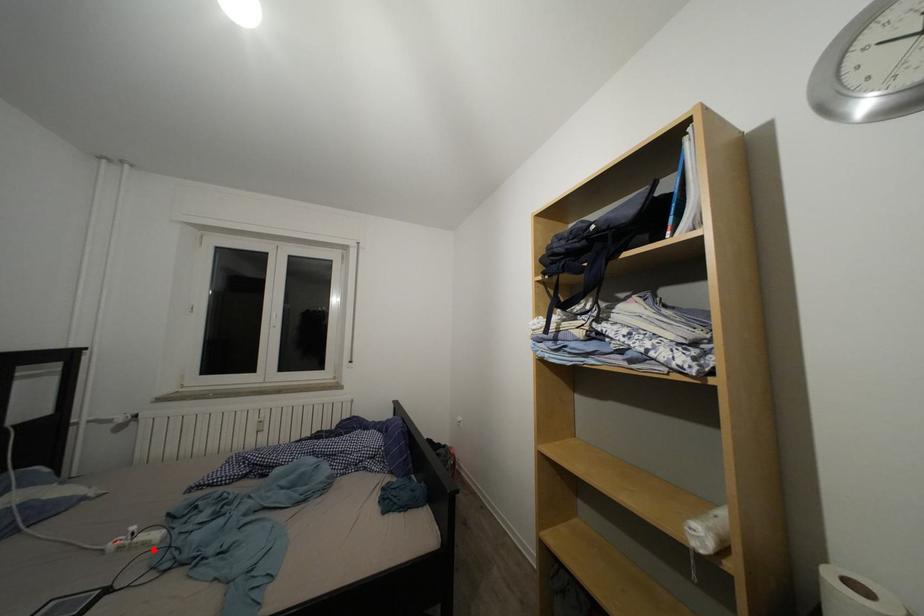
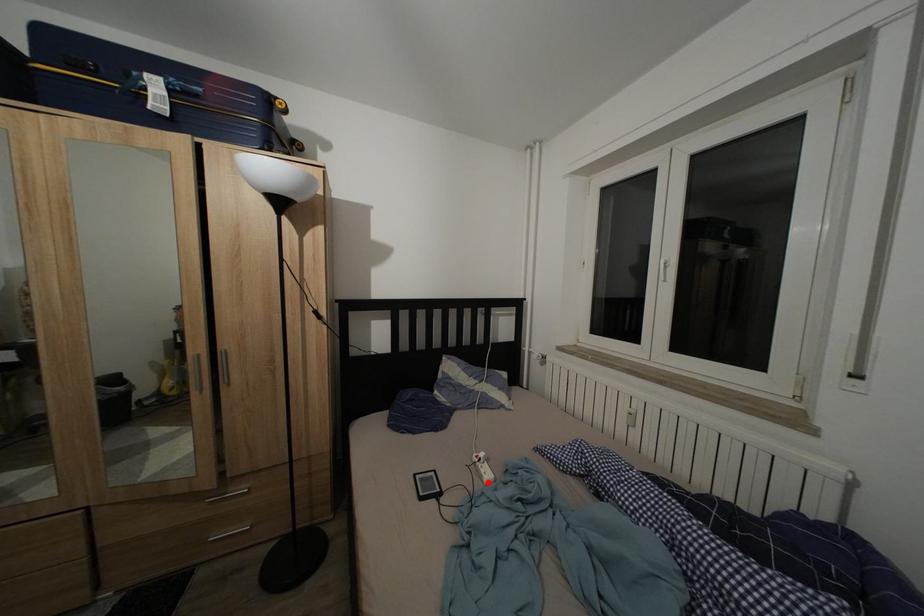
I am providing you with two images of the same scene from different viewpoints. A red point is marked on the first image and another point is marked on the second image. Is the red point in image1 aligned with the point shown in image2?

Yes